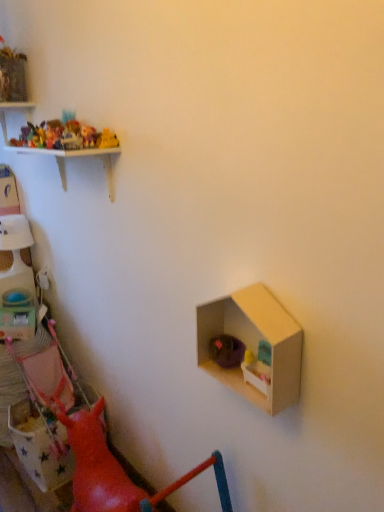
The width and height of the screenshot is (384, 512). In order to click on matte cardboard dollhouse at center right in this screenshot , I will do `click(254, 344)`.

Describe the element at coordinates (254, 344) in the screenshot. I see `matte cardboard dollhouse at center right` at that location.

Describe the element at coordinates (226, 351) in the screenshot. I see `purple fabric basket at lower right, marked as the 4th toy in a back-to-front arrangement` at that location.

Where is `purple fabric basket at lower right, marked as the 4th toy in a left-to-right arrangement`? purple fabric basket at lower right, marked as the 4th toy in a left-to-right arrangement is located at coordinates (226, 351).

The width and height of the screenshot is (384, 512). I want to click on plastic toy car at upper left, marked as the 3th toy in a back-to-front arrangement, so click(88, 135).

Locate an element on the screen. Image resolution: width=384 pixels, height=512 pixels. matte cardboard dollhouse at center right is located at coordinates (254, 344).

Looking at this image, is matte cardboard dollhouse at center right bigger than plastic toys at upper left, which is the second toy in top-to-bottom order?

Correct, matte cardboard dollhouse at center right is larger in size than plastic toys at upper left, which is the second toy in top-to-bottom order.

In the scene shown: Is matte cardboard dollhouse at center right positioned with its back to plastic toys at upper left, the third toy when ordered from front to back?

No, matte cardboard dollhouse at center right is not facing the opposite direction of plastic toys at upper left, the third toy when ordered from front to back.

Is matte cardboard dollhouse at center right thinner than plastic toys at upper left, arranged as the 3th toy when ordered from the bottom?

In fact, matte cardboard dollhouse at center right might be wider than plastic toys at upper left, arranged as the 3th toy when ordered from the bottom.

What's the angular difference between matte cardboard dollhouse at center right and plastic toys at upper left, the third toy when ordered from front to back,'s facing directions?

The angle between the facing direction of matte cardboard dollhouse at center right and the facing direction of plastic toys at upper left, the third toy when ordered from front to back, is 0.00615 degrees.

Considering the relative positions of plastic toys at upper left, which is the 2th toy in left-to-right order, and purple fabric basket at lower right, marked as the 4th toy in a back-to-front arrangement, in the image provided, is plastic toys at upper left, which is the 2th toy in left-to-right order, to the left or to the right of purple fabric basket at lower right, marked as the 4th toy in a back-to-front arrangement,?

In the image, plastic toys at upper left, which is the 2th toy in left-to-right order, appears on the left side of purple fabric basket at lower right, marked as the 4th toy in a back-to-front arrangement.

How far apart are plastic toys at upper left, the 4th toy when ordered from front to back, and purple fabric basket at lower right, the 4th toy in the top-to-bottom sequence?

plastic toys at upper left, the 4th toy when ordered from front to back, is 79.16 centimeters from purple fabric basket at lower right, the 4th toy in the top-to-bottom sequence.

Consider the image. Does plastic toys at upper left, the 1th toy from the top, come behind purple fabric basket at lower right, marked as the 1th toy in a right-to-left arrangement?

Yes, it is behind purple fabric basket at lower right, marked as the 1th toy in a right-to-left arrangement.

Could you tell me if plastic toys at upper left, the 1th toy from the top, is facing purple fabric basket at lower right, the 4th toy in the top-to-bottom sequence?

No, plastic toys at upper left, the 1th toy from the top, is not aimed at purple fabric basket at lower right, the 4th toy in the top-to-bottom sequence.

Who is smaller, plastic toy car at upper left, which is counted as the third toy, starting from the top, or purple fabric basket at lower right, the first toy from the front?

plastic toy car at upper left, which is counted as the third toy, starting from the top, is smaller.

Is plastic toy car at upper left, marked as the 3th toy in a back-to-front arrangement, turned away from purple fabric basket at lower right, marked as the 1th toy in a right-to-left arrangement?

No.

Which of these two, plastic toy car at upper left, positioned as the 3th toy in left-to-right order, or purple fabric basket at lower right, which is the 1th toy from bottom to top, is wider?

purple fabric basket at lower right, which is the 1th toy from bottom to top.

From the image's perspective, between plastic toy car at upper left, the second toy positioned from the front, and purple fabric basket at lower right, which is the 1th toy from bottom to top, which one is located above?

plastic toy car at upper left, the second toy positioned from the front, appears higher in the image.

From the image's perspective, is matte plastic toy box at left located above plastic toys at upper left, the fourth toy positioned from the right?

No, from the image's perspective, matte plastic toy box at left is not over plastic toys at upper left, the fourth toy positioned from the right.

Is matte plastic toy box at left positioned far away from plastic toys at upper left, arranged as the 1th toy when viewed from the left?

No, matte plastic toy box at left is in close proximity to plastic toys at upper left, arranged as the 1th toy when viewed from the left.

Who is taller, matte plastic toy box at left or plastic toys at upper left, the third toy when ordered from front to back?

matte plastic toy box at left is taller.

How many degrees apart are the facing directions of matte plastic toy box at left and plastic toys at upper left, which appears as the 2th toy when viewed from the back?

24.8 degrees.

Is plastic toy car at upper left, positioned as the 2th toy in bottom-to-top order, shorter than plastic toys at upper left, the third toy when ordered from front to back?

Yes, plastic toy car at upper left, positioned as the 2th toy in bottom-to-top order, is shorter than plastic toys at upper left, the third toy when ordered from front to back.

Which toy is the 1st one when counting from the back of the plastic toy car at upper left, positioned as the 3th toy in left-to-right order? Please provide its 2D coordinates.

[(53, 133)]

Which is nearer, (x=84, y=142) or (x=55, y=129)?

Point (x=84, y=142).

Are plastic toy car at upper left, the second toy positioned from the front, and plastic toys at upper left, arranged as the 1th toy when viewed from the left, far apart?

→ No, plastic toy car at upper left, the second toy positioned from the front, is in close proximity to plastic toys at upper left, arranged as the 1th toy when viewed from the left.

Which is more to the right, purple fabric basket at lower right, the first toy from the front, or plastic toys at upper left, arranged as the 1th toy when viewed from the left?

purple fabric basket at lower right, the first toy from the front, is more to the right.

Is there a large distance between purple fabric basket at lower right, marked as the 1th toy in a right-to-left arrangement, and plastic toys at upper left, arranged as the 3th toy when ordered from the bottom?

No.

From a real-world perspective, is purple fabric basket at lower right, marked as the 4th toy in a back-to-front arrangement, over plastic toys at upper left, the fourth toy positioned from the right?

Incorrect, from a real-world perspective, purple fabric basket at lower right, marked as the 4th toy in a back-to-front arrangement, is lower than plastic toys at upper left, the fourth toy positioned from the right.

Can you tell me how much plastic toys at upper left, which appears as the 2th toy when viewed from the back, and plastic toys at upper left, the 4th toy when ordered from front to back, differ in facing direction?

The angular difference between plastic toys at upper left, which appears as the 2th toy when viewed from the back, and plastic toys at upper left, the 4th toy when ordered from front to back, is 0.00273 degrees.

Is point (54, 147) in front of point (73, 125)?

Yes.

From the picture: Is plastic toys at upper left, arranged as the 1th toy when viewed from the left, with plastic toys at upper left, which is the 2th toy in left-to-right order?

Yes, plastic toys at upper left, arranged as the 1th toy when viewed from the left, is in contact with plastic toys at upper left, which is the 2th toy in left-to-right order.

Looking at this image, does plastic toys at upper left, arranged as the 3th toy when ordered from the bottom, appear on the right side of plastic toys at upper left, the 4th toy when ordered from front to back?

In fact, plastic toys at upper left, arranged as the 3th toy when ordered from the bottom, is to the left of plastic toys at upper left, the 4th toy when ordered from front to back.

Locate an element on the screen. The image size is (384, 512). toy that is the 2nd one when counting upward from the matte cardboard dollhouse at center right (from the image's perspective) is located at coordinates (53, 133).

From a real-world perspective, starting from the purple fabric basket at lower right, the first toy from the front, which toy is the 3rd one vertically above it? Please provide its 2D coordinates.

[(71, 136)]

Based on the photo, based on their spatial positions, is purple fabric basket at lower right, the first toy from the front, or plastic toys at upper left, which appears as the 2th toy when viewed from the back, closer to matte plastic toy box at left?

plastic toys at upper left, which appears as the 2th toy when viewed from the back, is positioned closer to the anchor matte plastic toy box at left.

When comparing their distances from plastic toys at upper left, the third toy when ordered from front to back, does plastic toys at upper left, the 1th toy viewed from the back, or plastic toy car at upper left, the second toy from the right, seem further?

plastic toy car at upper left, the second toy from the right, lies further to plastic toys at upper left, the third toy when ordered from front to back, than the other object.

From the image, which object appears to be farther from matte cardboard dollhouse at center right, matte plastic toy box at left or plastic toys at upper left, arranged as the 3th toy when ordered from the bottom?

matte plastic toy box at left lies further to matte cardboard dollhouse at center right than the other object.

Based on their spatial positions, is matte cardboard dollhouse at center right or matte plastic toy box at left further from purple fabric basket at lower right, which is the 1th toy from bottom to top?

matte plastic toy box at left.

From the image, which object appears to be farther from matte plastic toy box at left, plastic toy car at upper left, which is counted as the third toy, starting from the top, or matte cardboard dollhouse at center right?

matte cardboard dollhouse at center right is further to matte plastic toy box at left.

Looking at the image, which one is located further to matte cardboard dollhouse at center right, purple fabric basket at lower right, which is the 1th toy from bottom to top, or plastic toys at upper left, arranged as the 3th toy when ordered from the bottom?

plastic toys at upper left, arranged as the 3th toy when ordered from the bottom, lies further to matte cardboard dollhouse at center right than the other object.

Which object lies further to the anchor point plastic toys at upper left, which is the 2th toy in left-to-right order, matte plastic toy box at left or plastic toy car at upper left, the second toy positioned from the front?

Based on the image, matte plastic toy box at left appears to be further to plastic toys at upper left, which is the 2th toy in left-to-right order.

Estimate the real-world distances between objects in this image. Which object is further from purple fabric basket at lower right, marked as the 4th toy in a back-to-front arrangement, matte plastic toy box at left or plastic toys at upper left, the 1th toy viewed from the back?

matte plastic toy box at left.

I want to click on shelf between plastic toys at upper left, positioned as the 4th toy in bottom-to-top order, and purple fabric basket at lower right, the first toy from the front, in the up-down direction, so point(254,344).

Locate an element on the screen. toy between plastic toys at upper left, arranged as the 3th toy when ordered from the bottom, and matte cardboard dollhouse at center right in the up-down direction is located at coordinates (88, 135).

This screenshot has width=384, height=512. Identify the location of toy that lies between plastic toys at upper left, arranged as the 3th toy when ordered from the bottom, and purple fabric basket at lower right, marked as the 1th toy in a right-to-left arrangement, from top to bottom. (88, 135).

In order to click on shelf between plastic toys at upper left, arranged as the 3th toy when ordered from the bottom, and purple fabric basket at lower right, the first toy from the front, in the vertical direction in this screenshot , I will do `click(254, 344)`.